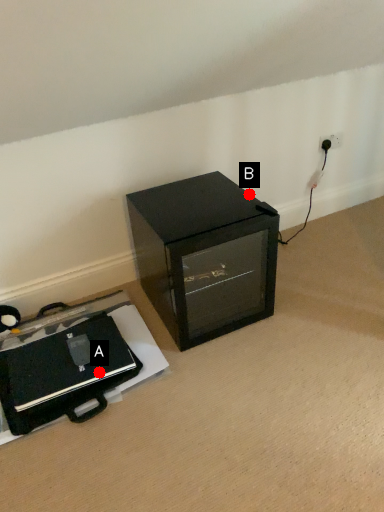
Question: Two points are circled on the image, labeled by A and B beside each circle. Which point appears closest to the camera in this image?

Choices:
 (A) A is closer
 (B) B is closer

Answer: (A)